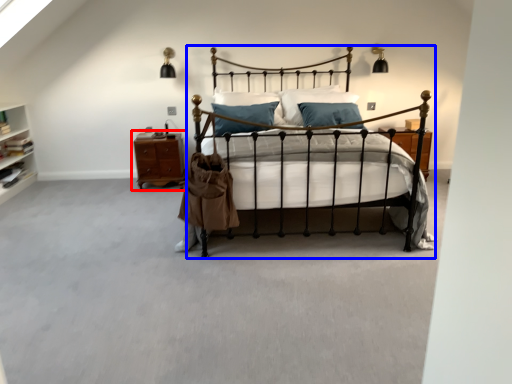
Question: Which of the following is the farthest to the observer, nightstand (highlighted by a red box) or bed (highlighted by a blue box)?

Choices:
 (A) nightstand
 (B) bed

Answer: (A)